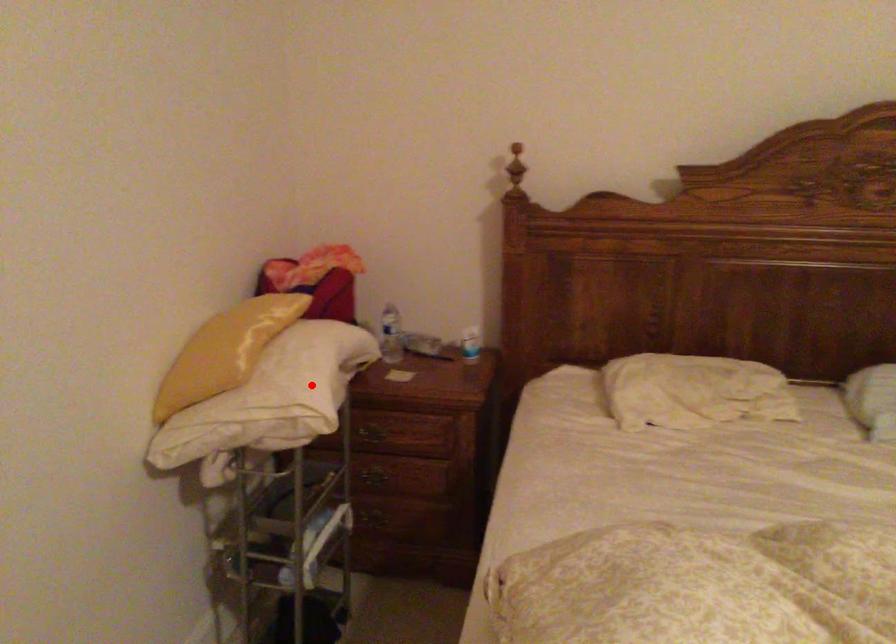
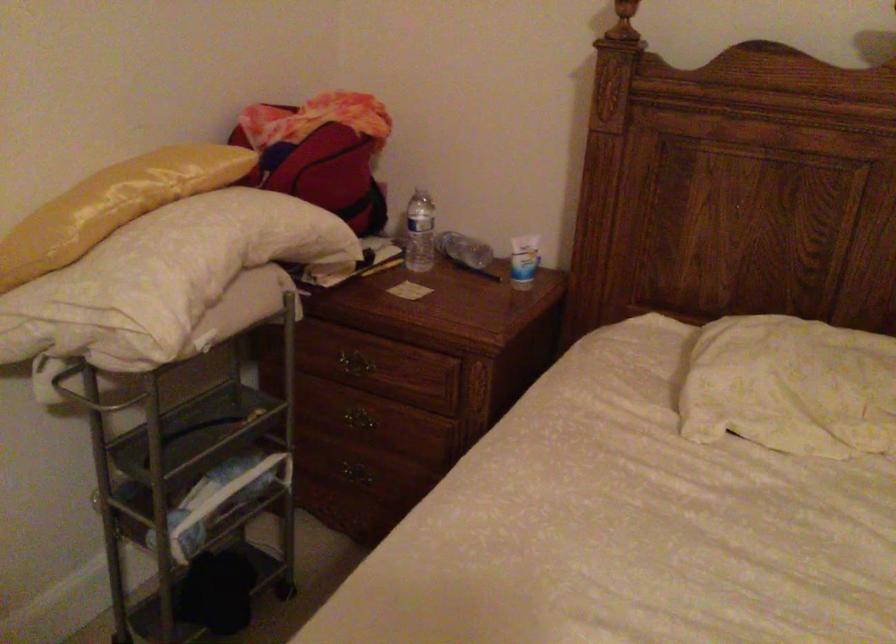
Question: I am providing you with two images of the same scene from different viewpoints. A red point is marked on the first image. Is the red point's position out of view in image 2?

Choices:
 (A) Yes
 (B) No

Answer: (B)